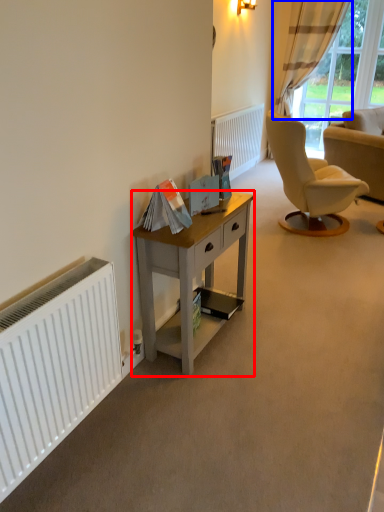
Question: Which object appears farthest to the camera in this image, desk (highlighted by a red box) or curtain (highlighted by a blue box)?

Choices:
 (A) desk
 (B) curtain

Answer: (B)